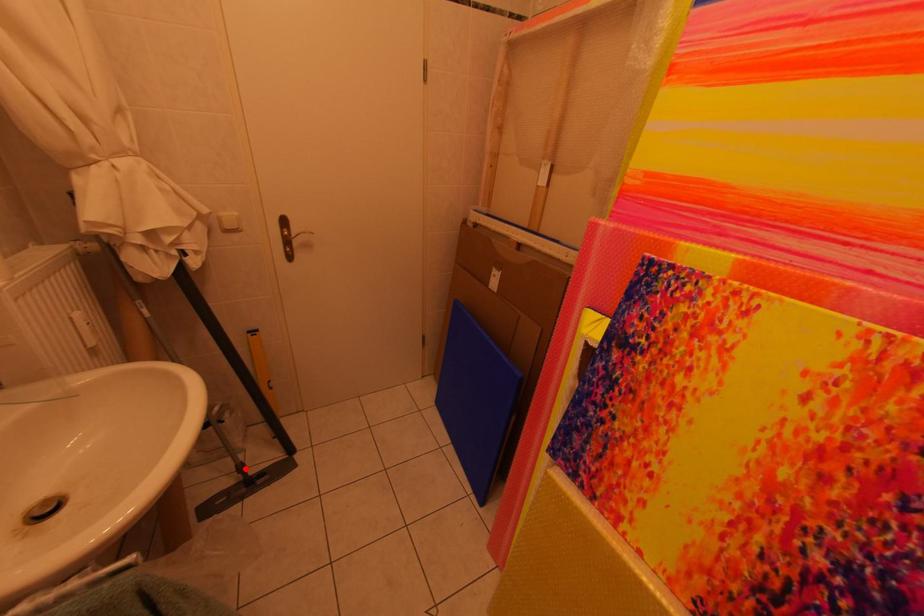
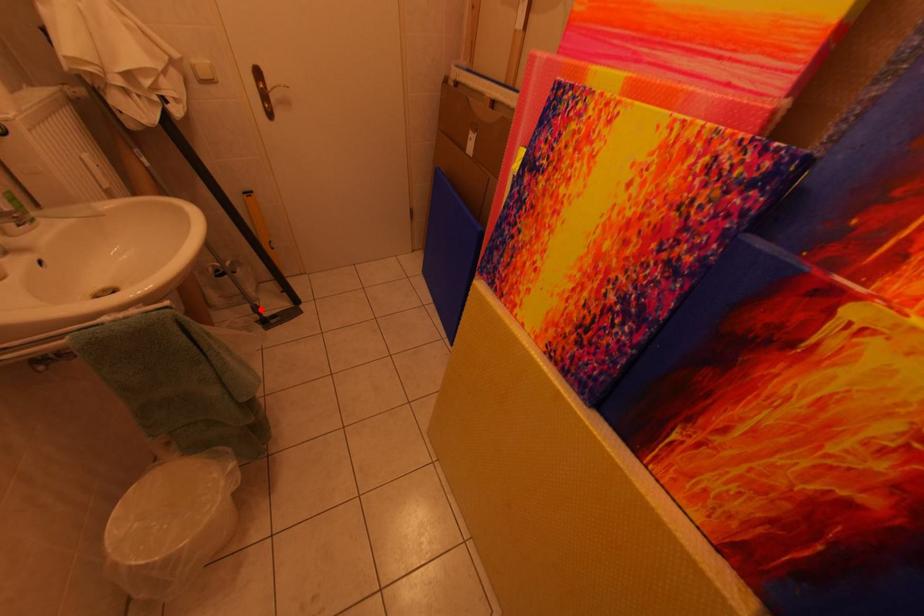
I am providing you with two images of the same scene from different viewpoints. A red point is marked on the first image and another point is marked on the second image. Do the highlighted points in image1 and image2 indicate the same real-world spot?

Yes